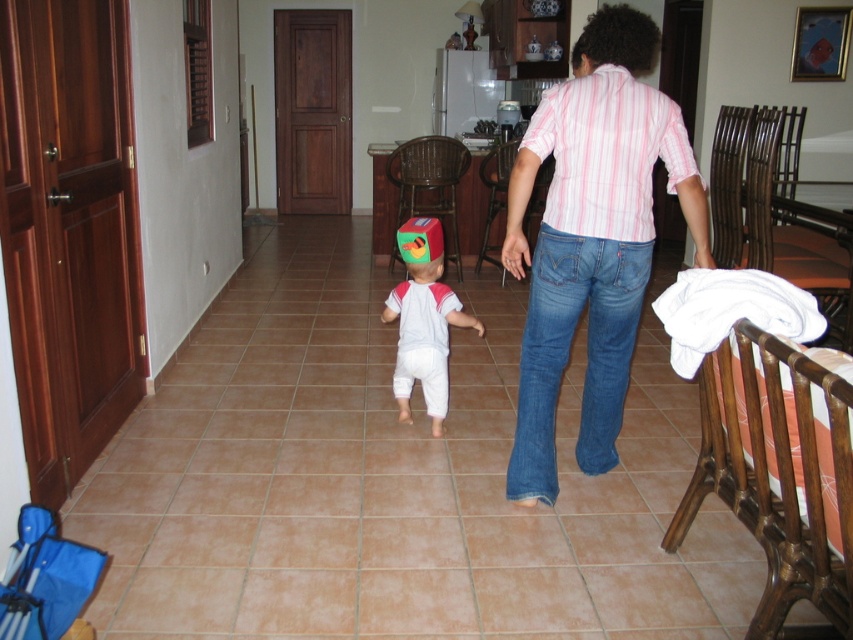
Where is `pink striped shirt at center`? The image size is (853, 640). pink striped shirt at center is located at coordinates (592, 240).

Does pink striped shirt at center appear on the right side of white cotton baby at center?

Yes, pink striped shirt at center is to the right of white cotton baby at center.

This screenshot has height=640, width=853. What are the coordinates of `pink striped shirt at center` in the screenshot? It's located at (592, 240).

Identify the location of pink striped shirt at center. (592, 240).